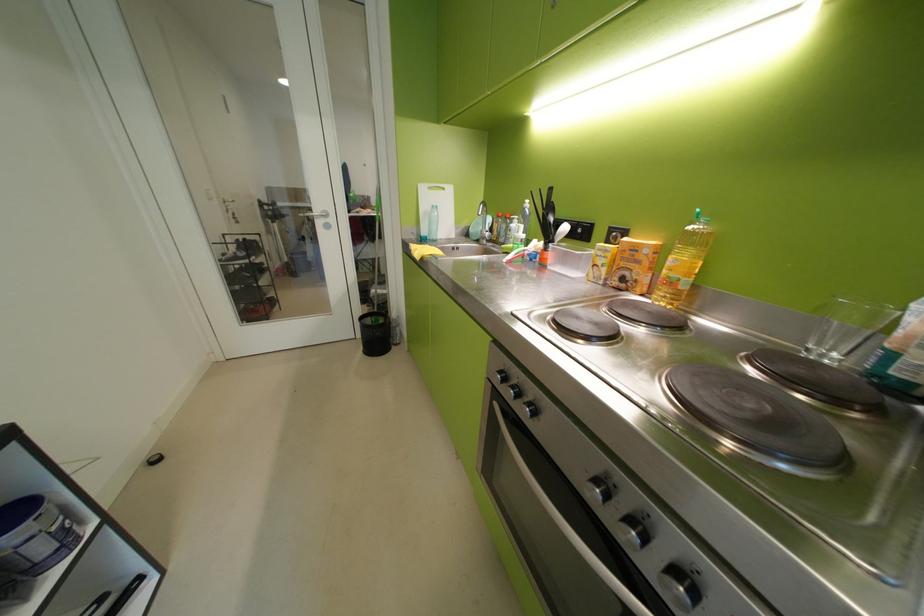
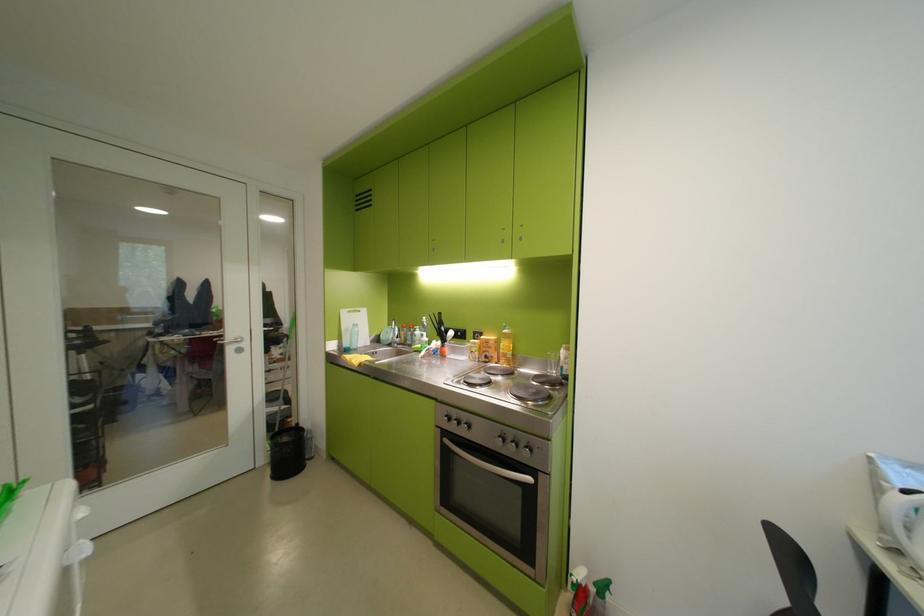
Locate, in the second image, the point that corresponds to pixel 649 262 in the first image.

(501, 349)